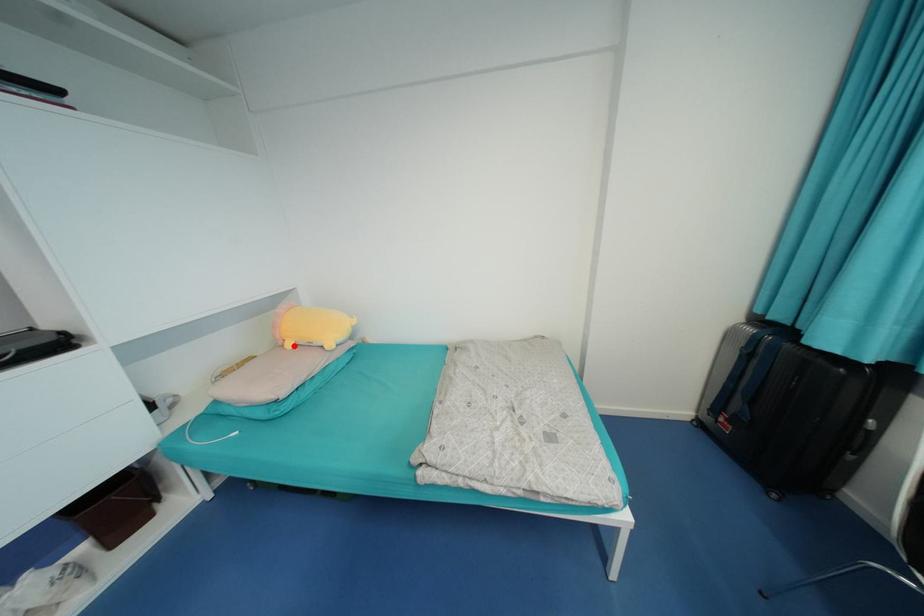
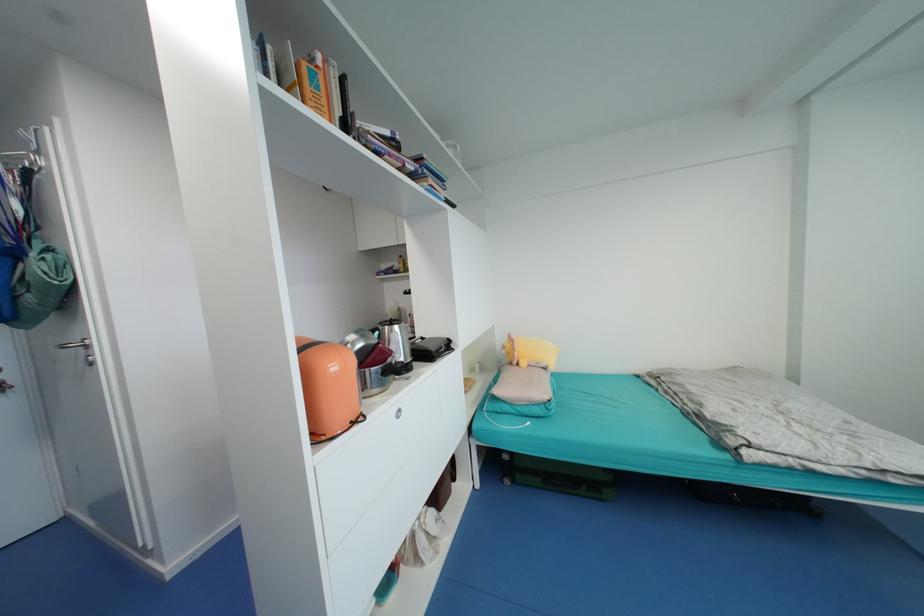
Find the pixel in the second image that matches the highlighted location in the first image.

(529, 365)